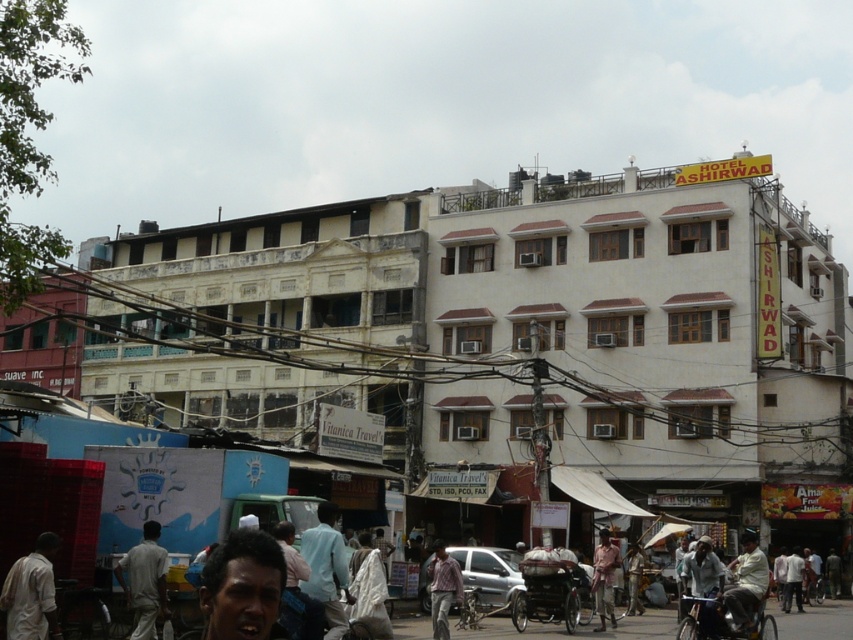
You are a photographer standing in the street and want to take a photo of both the plaid shirt at center and the light blue fabric shirt at center. Which shirt should you focus on first to ensure both are in clear view?

You should focus on the plaid shirt at center first since it is closer to the viewer, ensuring both shirts will be in clear view when focused properly.

In the bustling urban street scene with the HOTEL ASHIRWAD building, there is a point labeled at coordinates (444, 588). What object or feature is located at that specific coordinate?

The point at coordinates (444, 588) corresponds to the plaid shirt at center.